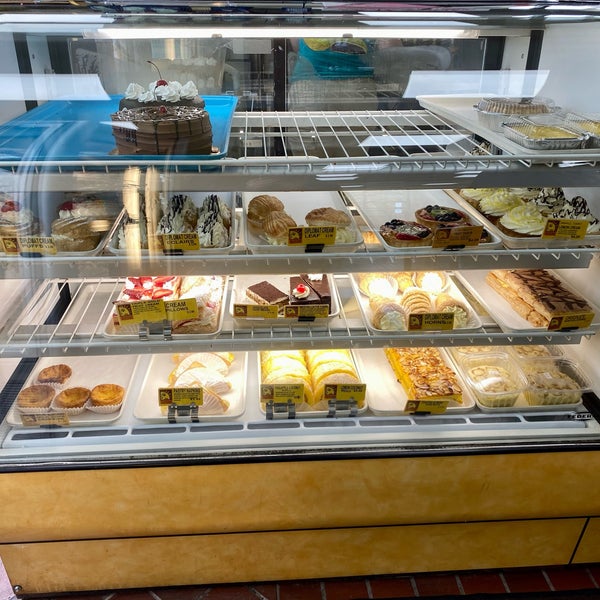
The width and height of the screenshot is (600, 600). I want to click on tile floor, so click(x=347, y=592).